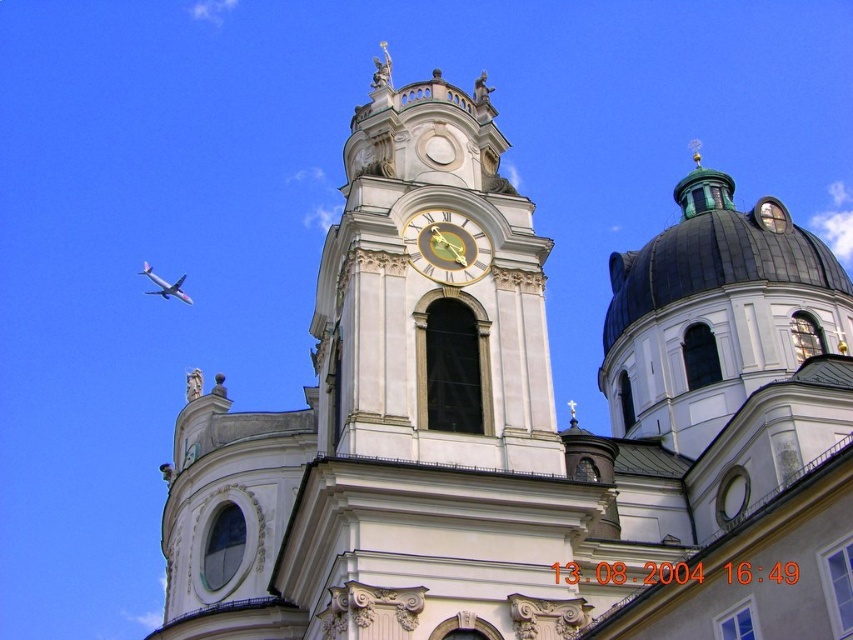
You are standing in front of the historic church or cathedral. You want to locate the goldmetallicclock at upper center. According to the coordinates provided, where exactly should you look to find it?

The goldmetallicclock at upper center is located at coordinates point (x=445, y=246), so you should look towards the upper center area of the tower to find it.

You are standing in front of the historic church and want to take a photo of the white stone clock tower at center without the metallic silver airplane at upper left appearing in the frame. Is this possible based on their positions?

Yes, the white stone clock tower at center is in front of the metallic silver airplane at upper left, so you can position yourself so that the tower blocks the view of the airplane, thus excluding it from the photo.

You are a tourist standing in front of the historic church or cathedral. You notice a point marked at coordinates [445,246]. Based on the scene description, what object does this point most likely represent?

The point at coordinates [445,246] most likely represents the gold metallic clock at upper center, as the description states that this point indicates the goldmetallicclock at upper center.